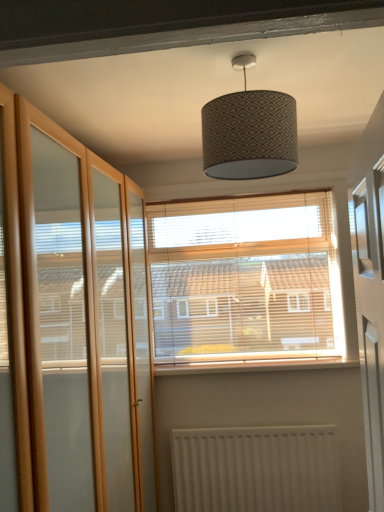
Question: Is white textured radiator at lower center facing towards clear glass screen door at left?

Choices:
 (A) no
 (B) yes

Answer: (A)

Question: Can you confirm if white textured radiator at lower center is smaller than clear glass screen door at left?

Choices:
 (A) no
 (B) yes

Answer: (B)

Question: Are white textured radiator at lower center and clear glass screen door at left beside each other?

Choices:
 (A) no
 (B) yes

Answer: (A)

Question: From a real-world perspective, is white textured radiator at lower center on top of clear glass screen door at left?

Choices:
 (A) no
 (B) yes

Answer: (A)

Question: Is white textured radiator at lower center taller than clear glass screen door at left?

Choices:
 (A) yes
 (B) no

Answer: (B)

Question: From the image's perspective, is patterned fabric lampshade at center positioned above or below wooden blinds at center?

Choices:
 (A) above
 (B) below

Answer: (A)

Question: Looking at the image, does patterned fabric lampshade at center seem bigger or smaller compared to wooden blinds at center?

Choices:
 (A) small
 (B) big

Answer: (A)

Question: Based on their positions, is patterned fabric lampshade at center located to the left or right of wooden blinds at center?

Choices:
 (A) right
 (B) left

Answer: (B)

Question: Considering the positions of patterned fabric lampshade at center and wooden blinds at center in the image, is patterned fabric lampshade at center taller or shorter than wooden blinds at center?

Choices:
 (A) tall
 (B) short

Answer: (B)

Question: Would you say clear glass screen door at left is inside or outside white textured radiator at lower center?

Choices:
 (A) outside
 (B) inside

Answer: (A)

Question: Considering the positions of point (49, 415) and point (274, 483), is point (49, 415) closer or farther from the camera than point (274, 483)?

Choices:
 (A) farther
 (B) closer

Answer: (B)

Question: From a real-world perspective, relative to white textured radiator at lower center, is clear glass screen door at left vertically above or below?

Choices:
 (A) below
 (B) above

Answer: (B)

Question: In the image, is clear glass screen door at left on the left side or the right side of white textured radiator at lower center?

Choices:
 (A) left
 (B) right

Answer: (A)

Question: In the image, is wooden blinds at center on the left side or the right side of white textured radiator at lower center?

Choices:
 (A) right
 (B) left

Answer: (B)

Question: Do you think wooden blinds at center is within white textured radiator at lower center, or outside of it?

Choices:
 (A) inside
 (B) outside

Answer: (B)